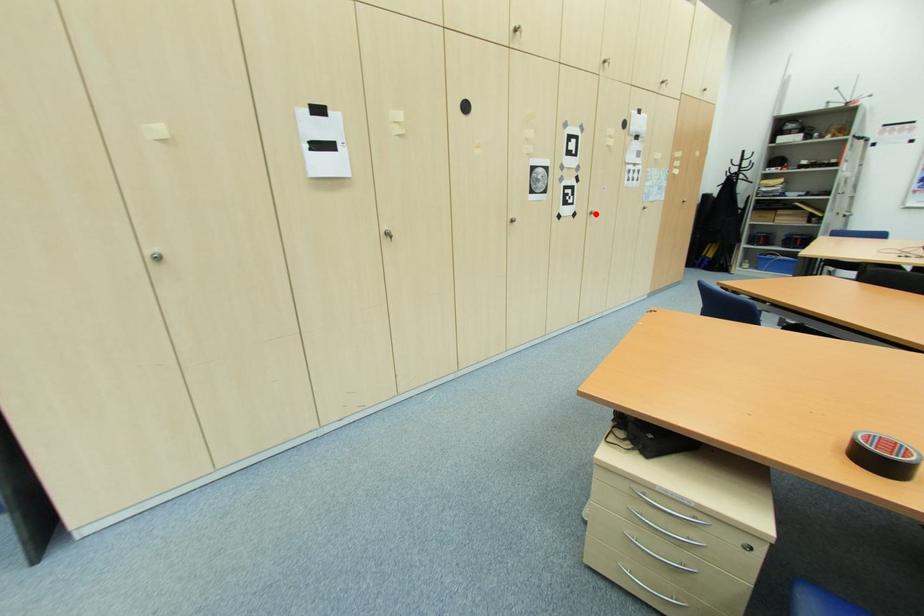
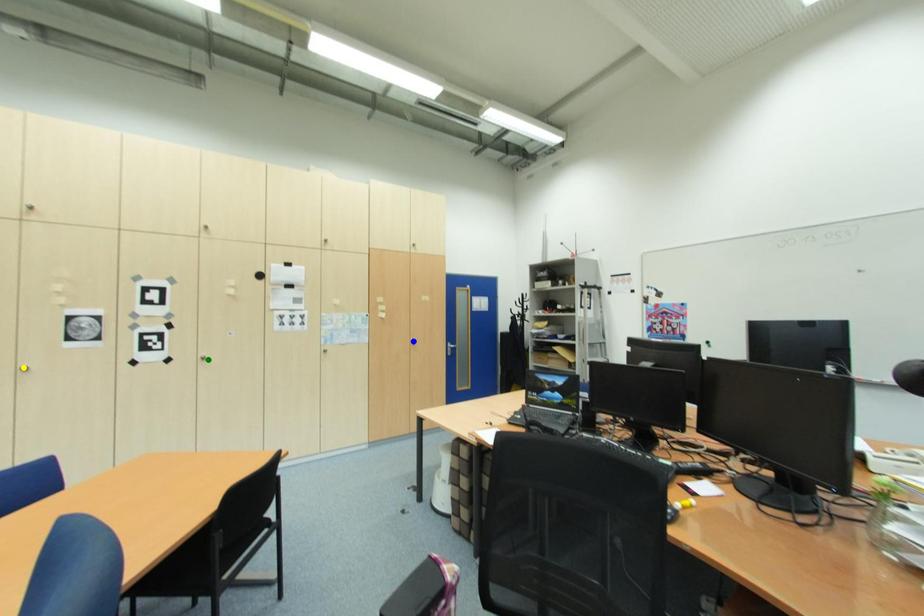
Question: I am providing you with two images of the same scene from different viewpoints. A red point is marked on the first image. You are given multiple points on the second image. Which point in image 2 represents the same 3d spot as the red point in image 1?

Choices:
 (A) yellow point
 (B) blue point
 (C) green point

Answer: (C)